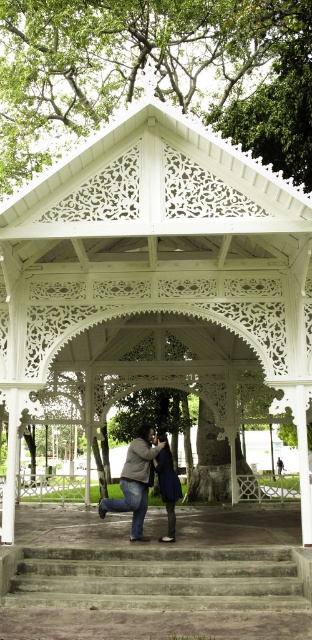
In the scene shown: You are standing at the point labeled point (210, 166) and want to walk to the gazebo. Is the point labeled point (166, 451) between you and the gazebo?

Point (210, 166) is in front of point (166, 451), so the point labeled point (166, 451) is behind you and not between you and the gazebo.

You are standing at the entrance of the white gazebo and want to go down the concrete stairs at lower center. Which direction should you walk to reach the point at coordinates point (157,579)?

The point at coordinates point (157,579) is located on the concrete stairs at lower center, so you should walk downward towards the center of the stairs to reach it.

You are planning to install a new bench along the concrete stairs at lower center. The bench needs to be placed on the side opposite to the white carved wood gazebo at center. Which side should you choose for the bench?

The white carved wood gazebo at center is positioned on the right side of concrete stairs at lower center, so the bench should be placed on the left side of the concrete stairs at lower center to be opposite the gazebo.